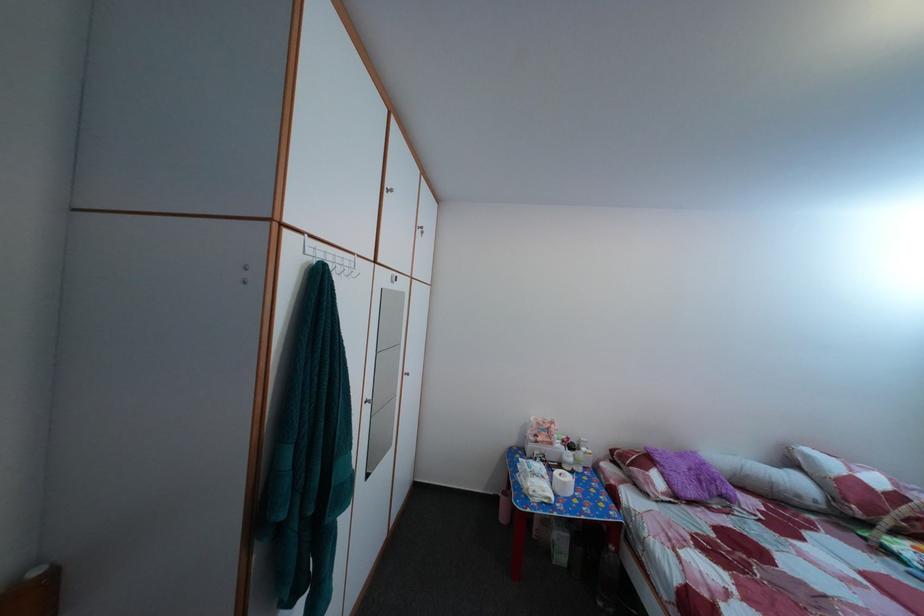
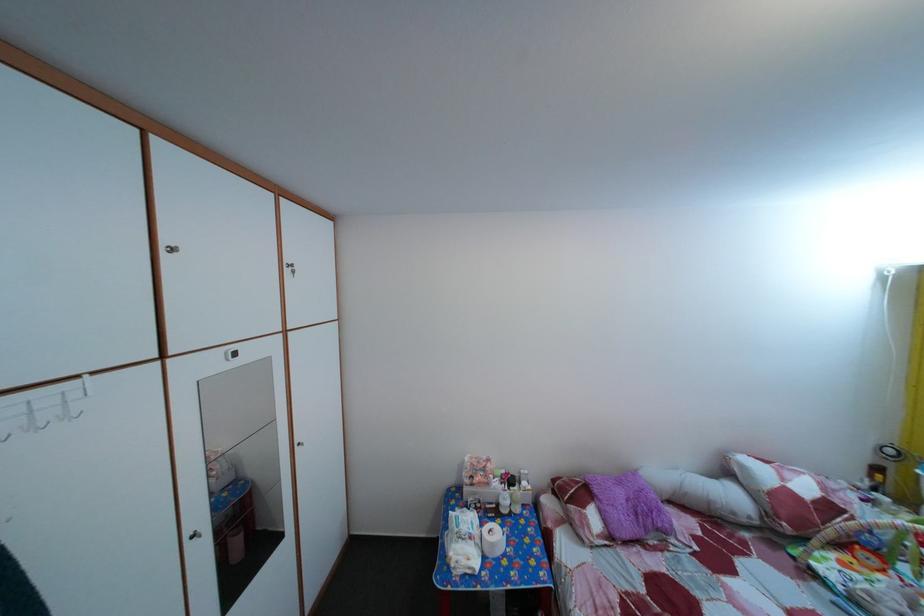
In the second image, find the point that corresponds to [574,492] in the first image.

(502, 553)